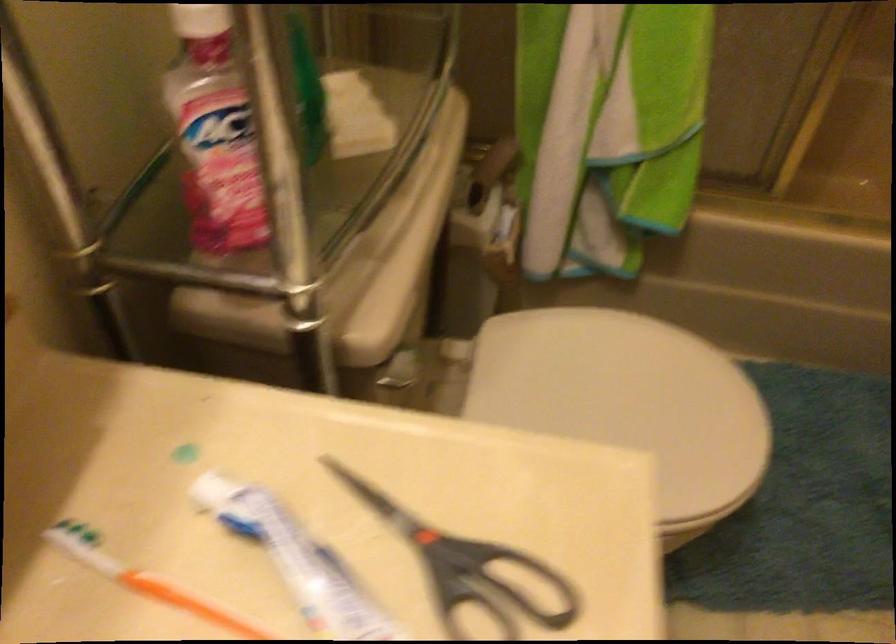
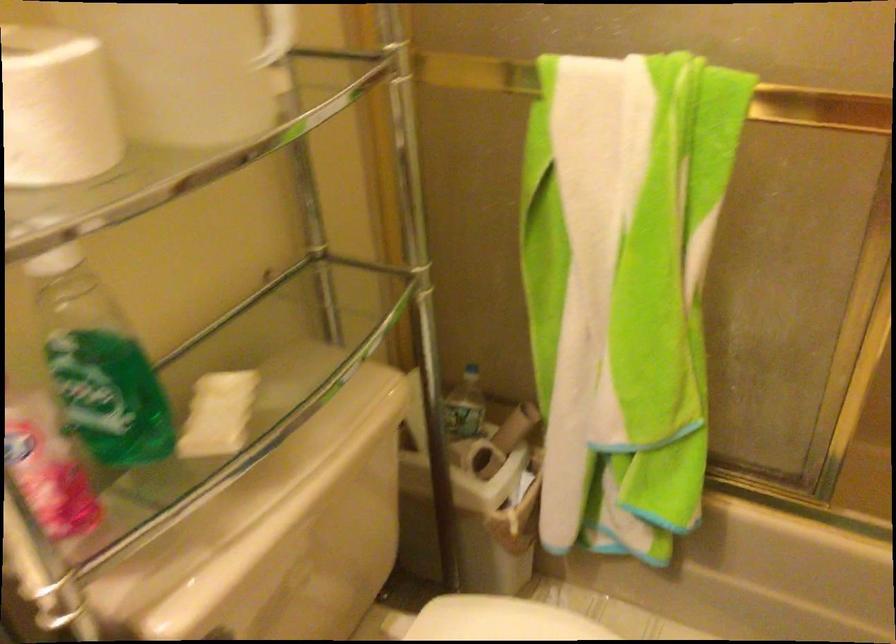
Question: The camera is either moving clockwise (left) or counter-clockwise (right) around the object. The first image is from the beginning of the video and the second image is from the end. Is the camera moving left or right when shooting the video?

Choices:
 (A) Left
 (B) Right

Answer: (B)